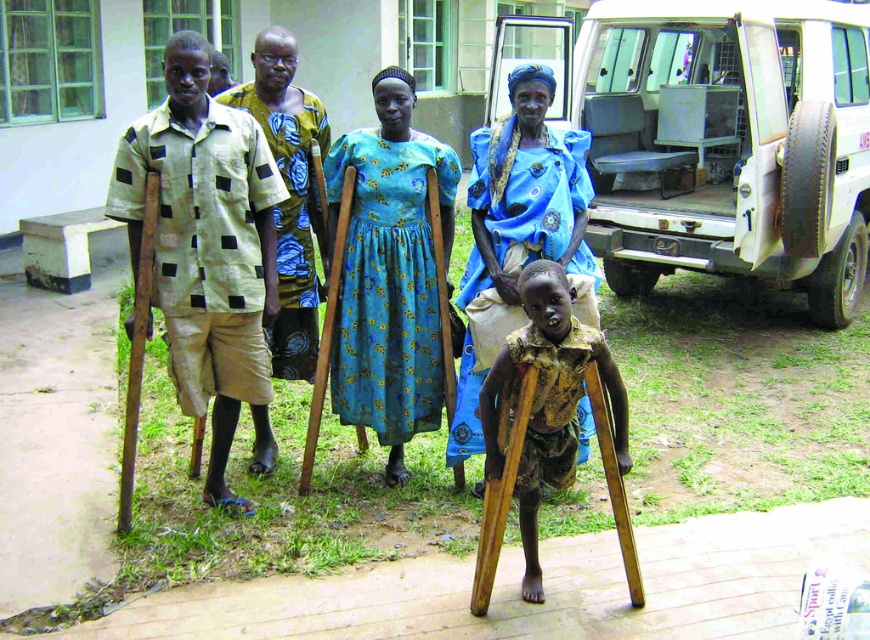
Locate an element on the screen. The height and width of the screenshot is (640, 870). beige fabric shirt at left is located at coordinates (205, 244).

Is beige fabric shirt at left smaller than yellow-green printed shirt at center?

Correct, beige fabric shirt at left occupies less space than yellow-green printed shirt at center.

Describe the element at coordinates (205, 244) in the screenshot. I see `beige fabric shirt at left` at that location.

At what (x,y) coordinates should I click in order to perform the action: click on beige fabric shirt at left. Please return your answer as a coordinate pair (x, y). Looking at the image, I should click on (205, 244).

Is wooden crutches at center taller than yellow-green printed shirt at center?

In fact, wooden crutches at center may be shorter than yellow-green printed shirt at center.

Is wooden crutches at center shorter than yellow-green printed shirt at center?

Yes, wooden crutches at center is shorter than yellow-green printed shirt at center.

Between point (547, 291) and point (319, 289), which one is positioned in front?

Point (547, 291)

Locate an element on the screen. This screenshot has width=870, height=640. wooden crutches at center is located at coordinates (547, 401).

Is blue floral dress at center further to the viewer compared to blue fabric dress at center?

Yes, it is.

Is blue floral dress at center shorter than blue fabric dress at center?

Yes.

Describe the element at coordinates (390, 273) in the screenshot. The image size is (870, 640). I see `blue floral dress at center` at that location.

Where is `blue floral dress at center`? The width and height of the screenshot is (870, 640). blue floral dress at center is located at coordinates (390, 273).